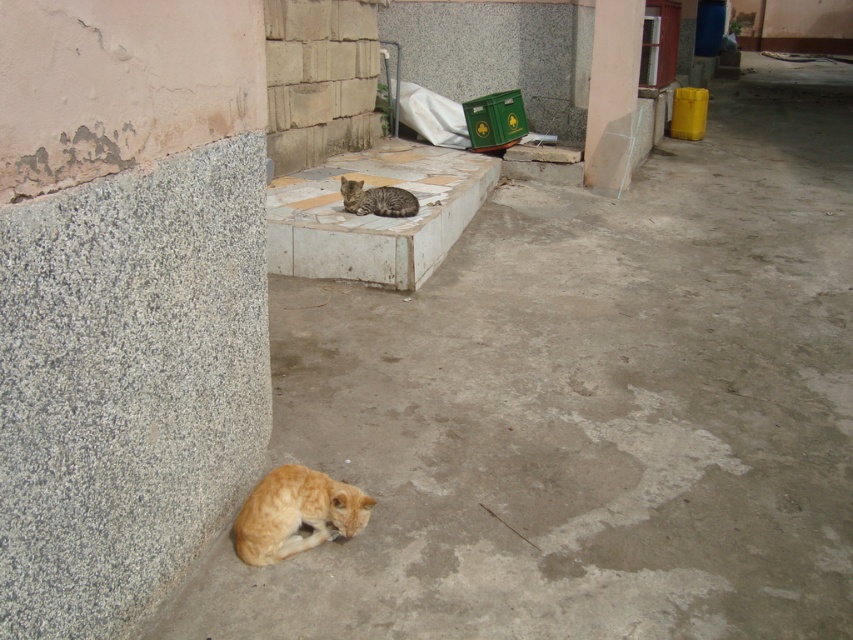
Consider the image. Who is more distant from viewer, (351, 525) or (368, 192)?

Positioned behind is point (368, 192).

Can you confirm if orange fur cat at lower left is wider than striped fur cat at center?

Incorrect, orange fur cat at lower left's width does not surpass striped fur cat at center's.

The width and height of the screenshot is (853, 640). What are the coordinates of `orange fur cat at lower left` in the screenshot? It's located at (296, 513).

Identify the location of orange fur cat at lower left. (296, 513).

Looking at this image, which of these two, gray stone cat at center or orange fur cat at lower left, stands shorter?

Standing shorter between the two is orange fur cat at lower left.

What do you see at coordinates (375, 216) in the screenshot? Image resolution: width=853 pixels, height=640 pixels. I see `gray stone cat at center` at bounding box center [375, 216].

Image resolution: width=853 pixels, height=640 pixels. I want to click on gray stone cat at center, so click(x=375, y=216).

Does gray stone cat at center appear on the left side of gray granite pillar at upper center?

Yes, gray stone cat at center is to the left of gray granite pillar at upper center.

Does gray stone cat at center come behind gray granite pillar at upper center?

That is False.

Locate an element on the screen. This screenshot has height=640, width=853. gray stone cat at center is located at coordinates (375, 216).